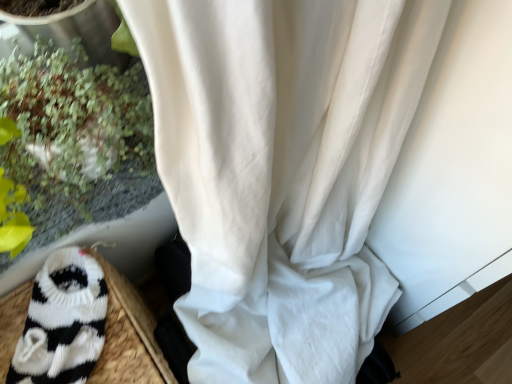
Measure the distance between white sheer curtain at center and camera.

The distance of white sheer curtain at center from camera is 8.71 inches.

Identify the location of black knitted sock at lower left. The width and height of the screenshot is (512, 384). (62, 321).

Identify the location of white sheer curtain at center. This screenshot has height=384, width=512. (282, 171).

Does green leafy plant at left have a smaller size compared to white sheer curtain at center?

Indeed, green leafy plant at left has a smaller size compared to white sheer curtain at center.

From a real-world perspective, is green leafy plant at left positioned above or below white sheer curtain at center?

green leafy plant at left is above white sheer curtain at center.

Is green leafy plant at left spatially inside white sheer curtain at center, or outside of it?

green leafy plant at left is not inside white sheer curtain at center, it's outside.

Is green leafy plant at left with white sheer curtain at center?

green leafy plant at left and white sheer curtain at center are clearly separated.

Would you say black knitted sock at lower left is part of green leafy plant at left's contents?

No, black knitted sock at lower left is not surrounded by green leafy plant at left.

From the image's perspective, which one is positioned lower, green leafy plant at left or black knitted sock at lower left?

black knitted sock at lower left, from the image's perspective.

You are a GUI agent. You are given a task and a screenshot of the screen. Output one action in this format:
    pyautogui.click(x=<x>, y=<y>)
    Task: Click on the animal on the left of green leafy plant at left
    The height and width of the screenshot is (384, 512).
    Given the screenshot: What is the action you would take?
    pyautogui.click(x=62, y=321)

How many degrees apart are the facing directions of white sheer curtain at center and green leafy plant at left?

There is a 1.24-degree angle between the facing directions of white sheer curtain at center and green leafy plant at left.

How distant is white sheer curtain at center from green leafy plant at left?

The distance of white sheer curtain at center from green leafy plant at left is 31.20 centimeters.

Considering the relative positions of white sheer curtain at center and green leafy plant at left in the image provided, is white sheer curtain at center to the left or to the right of green leafy plant at left?

In the image, white sheer curtain at center appears on the right side of green leafy plant at left.

Between white sheer curtain at center and green leafy plant at left, which one has smaller width?

green leafy plant at left is thinner.

Which of these two, black knitted sock at lower left or green leafy plant at left, is wider?

Wider between the two is green leafy plant at left.

Which is in front, point (42, 331) or point (66, 163)?

Positioned in front is point (66, 163).

Between black knitted sock at lower left and green leafy plant at left, which one is positioned behind?

Positioned behind is black knitted sock at lower left.

From the image's perspective, between black knitted sock at lower left and green leafy plant at left, which one is located above?

green leafy plant at left is shown above in the image.

Does black knitted sock at lower left have a lesser height compared to white sheer curtain at center?

Yes, black knitted sock at lower left is shorter than white sheer curtain at center.

Is the depth of black knitted sock at lower left less than that of white sheer curtain at center?

Yes.

In terms of width, does black knitted sock at lower left look wider or thinner when compared to white sheer curtain at center?

black knitted sock at lower left is thinner than white sheer curtain at center.

From a real-world perspective, does black knitted sock at lower left stand above white sheer curtain at center?

Yes, from a real-world perspective, black knitted sock at lower left is on top of white sheer curtain at center.

Which is closer to the camera, (163, 141) or (92, 289)?

The point (163, 141) is more forward.

Consider the image. Is white sheer curtain at center at the right side of black knitted sock at lower left?

Yes.

Is white sheer curtain at center shorter than black knitted sock at lower left?

No.

How distant is white sheer curtain at center from black knitted sock at lower left?

The distance of white sheer curtain at center from black knitted sock at lower left is 14.24 inches.

Find the location of a particular element. curtain beneath the green leafy plant at left (from a real-world perspective) is located at coordinates (282, 171).

I want to click on animal behind the green leafy plant at left, so click(x=62, y=321).

Which object lies further to the anchor point green leafy plant at left, white sheer curtain at center or black knitted sock at lower left?

white sheer curtain at center.

Which object lies further to the anchor point white sheer curtain at center, green leafy plant at left or black knitted sock at lower left?

black knitted sock at lower left is positioned further to the anchor white sheer curtain at center.

From the image, which object appears to be farther from black knitted sock at lower left, white sheer curtain at center or green leafy plant at left?

white sheer curtain at center is positioned further to the anchor black knitted sock at lower left.

Consider the image. Looking at the image, which one is located further to black knitted sock at lower left, green leafy plant at left or white sheer curtain at center?

white sheer curtain at center is positioned further to the anchor black knitted sock at lower left.

In the scene shown: Which object lies further to the anchor point green leafy plant at left, black knitted sock at lower left or white sheer curtain at center?

Based on the image, white sheer curtain at center appears to be further to green leafy plant at left.

Based on the photo, based on their spatial positions, is black knitted sock at lower left or green leafy plant at left further from white sheer curtain at center?

black knitted sock at lower left is positioned further to the anchor white sheer curtain at center.

This screenshot has height=384, width=512. What are the coordinates of `animal between green leafy plant at left and white sheer curtain at center in the vertical direction` in the screenshot? It's located at (62, 321).